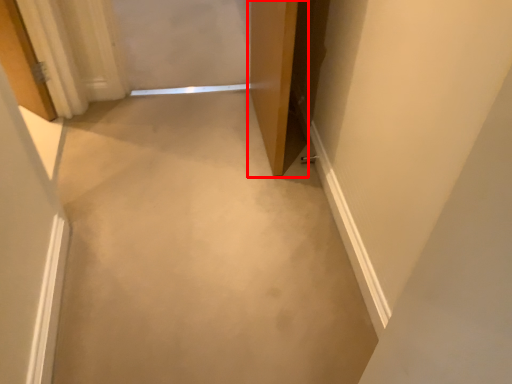
Question: Observing the image, what is the correct spatial positioning of door (annotated by the red box) in reference to concrete?

Choices:
 (A) left
 (B) right

Answer: (B)